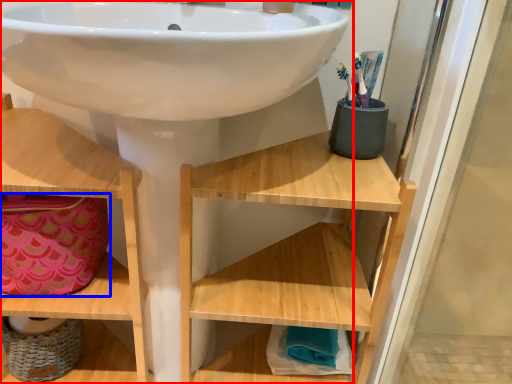
Question: Which of the following is the closest to the observer, sink (highlighted by a red box) or material (highlighted by a blue box)?

Choices:
 (A) sink
 (B) material

Answer: (A)